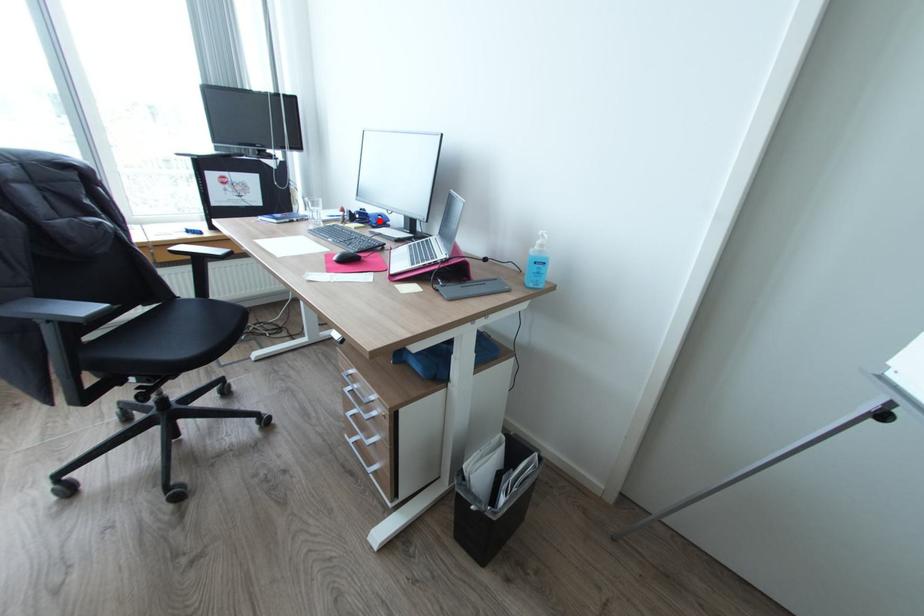
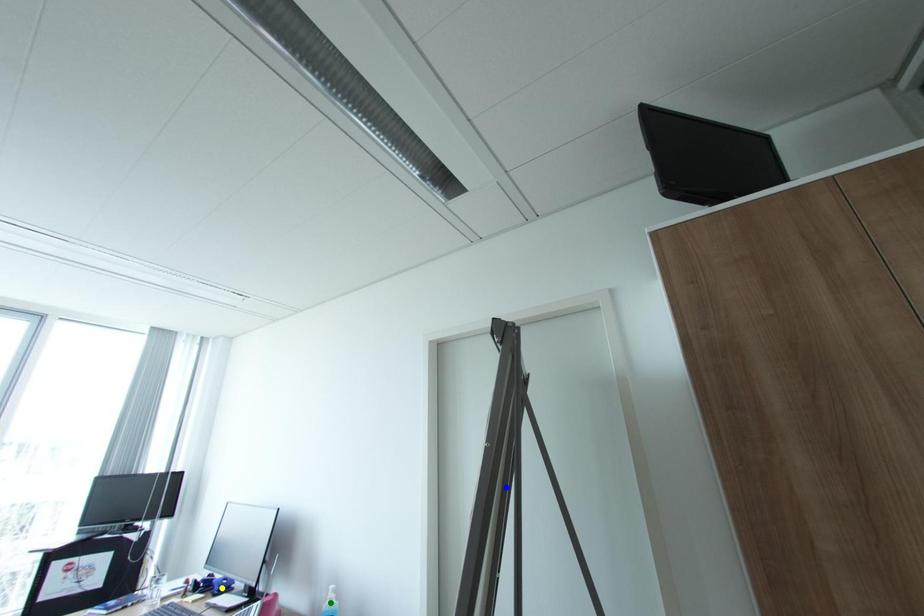
Question: I am providing you with two images of the same scene from different viewpoints. A red point is marked on the first image. You are given multiple points on the second image. Which point in image 2 is actually the same real-world point as the red point in image 1?

Choices:
 (A) blue point
 (B) yellow point
 (C) green point

Answer: (B)